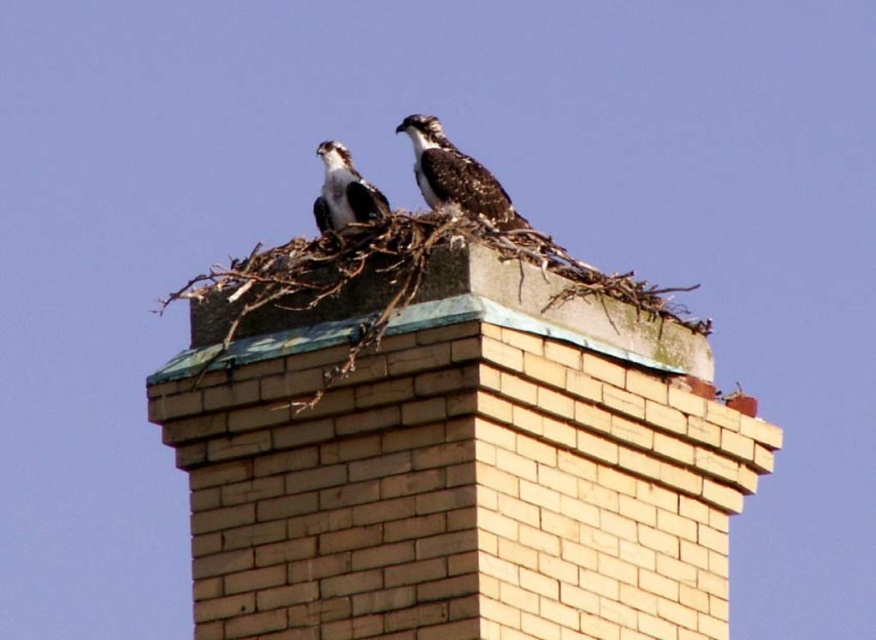
Question: Considering the relative positions of beige brick chimney at center and dark brown speckled feathers at center in the image provided, where is beige brick chimney at center located with respect to dark brown speckled feathers at center?

Choices:
 (A) below
 (B) above

Answer: (A)

Question: Can you confirm if beige brick chimney at center is positioned above dark brown speckled feathers at center?

Choices:
 (A) yes
 (B) no

Answer: (B)

Question: Is dark brown speckled feathers at center thinner than brown speckled feathers at center?

Choices:
 (A) no
 (B) yes

Answer: (A)

Question: Which point is closer to the camera?

Choices:
 (A) (329, 204)
 (B) (345, 595)

Answer: (B)

Question: Among these objects, which one is farthest from the camera?

Choices:
 (A) brown speckled feathers at center
 (B) beige brick chimney at center
 (C) dark brown speckled feathers at center

Answer: (A)

Question: Which point appears closest to the camera in this image?

Choices:
 (A) (366, 284)
 (B) (451, 189)
 (C) (336, 179)

Answer: (A)